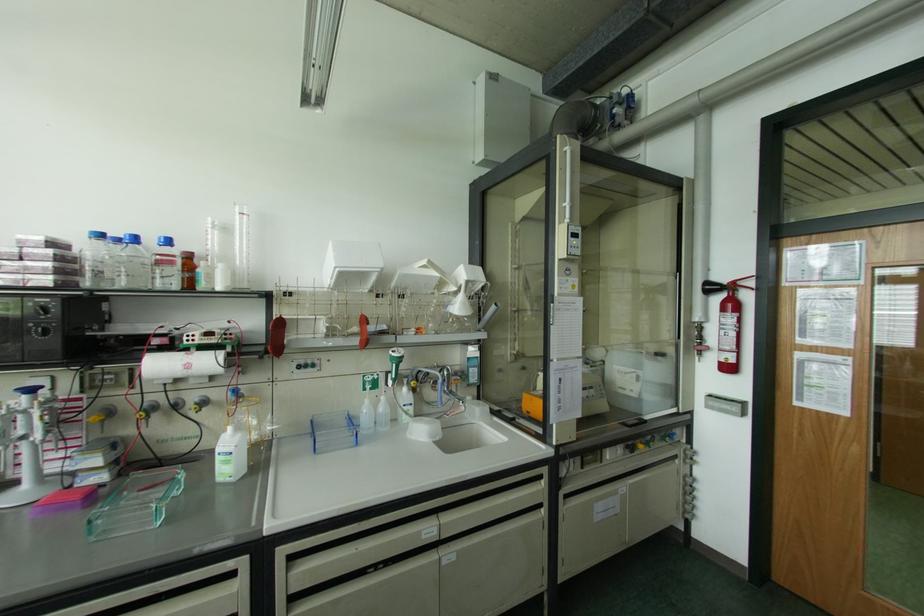
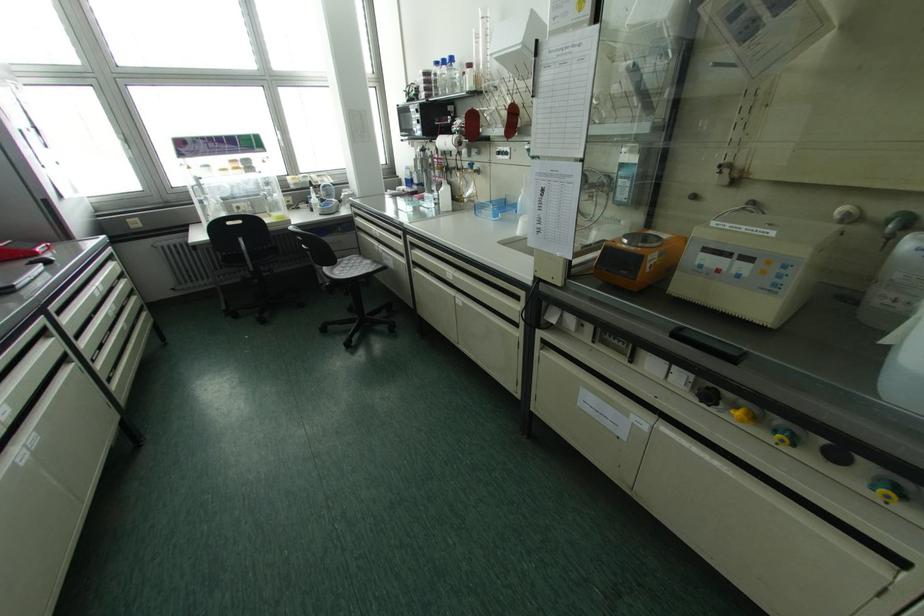
Locate, in the second image, the point that corresponds to point (101, 236) in the first image.

(435, 63)